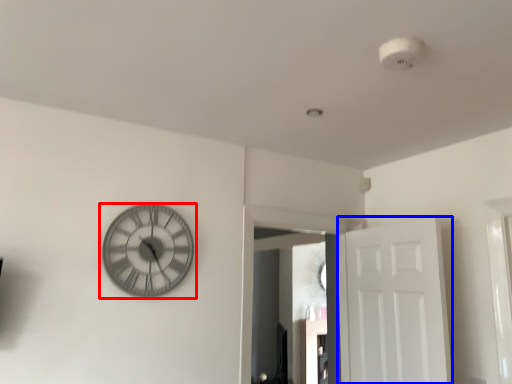
Question: Which object is further to the camera taking this photo, wall clock (highlighted by a red box) or door (highlighted by a blue box)?

Choices:
 (A) wall clock
 (B) door

Answer: (B)